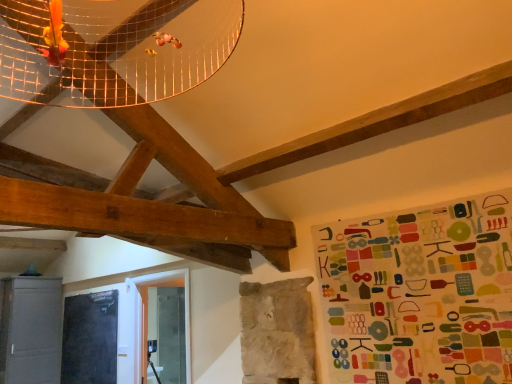
The width and height of the screenshot is (512, 384). What are the coordinates of `black matte bulletin board at lower left` in the screenshot? It's located at (90, 338).

In order to face black matte bulletin board at lower left, should I rotate leftwards or rightwards?

You should rotate left by 21.650 degrees.

What do you see at coordinates (90, 338) in the screenshot?
I see `black matte bulletin board at lower left` at bounding box center [90, 338].

Measure the distance between black matte bulletin board at lower left and camera.

A distance of 4.61 meters exists between black matte bulletin board at lower left and camera.

I want to click on matte gray cabinet at lower left, so click(x=31, y=330).

Describe the element at coordinates (31, 330) in the screenshot. This screenshot has width=512, height=384. I see `matte gray cabinet at lower left` at that location.

Identify the location of black matte bulletin board at lower left. (90, 338).

Would you say black matte bulletin board at lower left is to the left or to the right of matte gray cabinet at lower left in the picture?

Clearly, black matte bulletin board at lower left is on the right of matte gray cabinet at lower left in the image.

Which is in front, black matte bulletin board at lower left or matte gray cabinet at lower left?

black matte bulletin board at lower left is closer to the camera.

Does point (91, 329) appear closer or farther from the camera than point (21, 355)?

Point (91, 329) appears to be farther away from the viewer than point (21, 355).

From the image's perspective, would you say black matte bulletin board at lower left is positioned over matte gray cabinet at lower left?

Yes, from the image's perspective, black matte bulletin board at lower left is over matte gray cabinet at lower left.

From a real-world perspective, is black matte bulletin board at lower left on top of matte gray cabinet at lower left?

No, from a real-world perspective, black matte bulletin board at lower left is not on top of matte gray cabinet at lower left.

Between black matte bulletin board at lower left and matte gray cabinet at lower left, which one has larger width?

matte gray cabinet at lower left.

Considering the sizes of black matte bulletin board at lower left and matte gray cabinet at lower left in the image, is black matte bulletin board at lower left taller or shorter than matte gray cabinet at lower left?

Clearly, black matte bulletin board at lower left is shorter compared to matte gray cabinet at lower left.

Who is smaller, black matte bulletin board at lower left or matte gray cabinet at lower left?

black matte bulletin board at lower left.

Is matte gray cabinet at lower left a part of black matte bulletin board at lower left?

That's incorrect, matte gray cabinet at lower left is not inside black matte bulletin board at lower left.

Is the surface of black matte bulletin board at lower left in direct contact with matte gray cabinet at lower left?

No, black matte bulletin board at lower left is not touching matte gray cabinet at lower left.

Is black matte bulletin board at lower left looking in the opposite direction of matte gray cabinet at lower left?

No.

In order to click on cabinetry located on the left of black matte bulletin board at lower left in this screenshot , I will do 31,330.

Is matte gray cabinet at lower left at the right side of black matte bulletin board at lower left?

In fact, matte gray cabinet at lower left is to the left of black matte bulletin board at lower left.

Who is more distant, matte gray cabinet at lower left or black matte bulletin board at lower left?

Positioned behind is matte gray cabinet at lower left.

Is point (30, 349) farther from camera compared to point (69, 354)?

No, it is not.

From the image's perspective, which is below, matte gray cabinet at lower left or black matte bulletin board at lower left?

matte gray cabinet at lower left appears lower in the image.

From a real-world perspective, is matte gray cabinet at lower left below black matte bulletin board at lower left?

No, from a real-world perspective, matte gray cabinet at lower left is not below black matte bulletin board at lower left.

In terms of width, does matte gray cabinet at lower left look wider or thinner when compared to black matte bulletin board at lower left?

In the image, matte gray cabinet at lower left appears to be wider than black matte bulletin board at lower left.

From their relative heights in the image, would you say matte gray cabinet at lower left is taller or shorter than black matte bulletin board at lower left?

Clearly, matte gray cabinet at lower left is taller compared to black matte bulletin board at lower left.

Which of these two, matte gray cabinet at lower left or black matte bulletin board at lower left, is smaller?

black matte bulletin board at lower left is smaller.

Is black matte bulletin board at lower left inside matte gray cabinet at lower left?

That's incorrect, black matte bulletin board at lower left is not inside matte gray cabinet at lower left.

Is matte gray cabinet at lower left not close to black matte bulletin board at lower left?

No, there isn't a large distance between matte gray cabinet at lower left and black matte bulletin board at lower left.

Is matte gray cabinet at lower left turned away from black matte bulletin board at lower left?

That's not correct — matte gray cabinet at lower left is not looking away from black matte bulletin board at lower left.

How different are the orientations of matte gray cabinet at lower left and black matte bulletin board at lower left in degrees?

They differ by 89.8 degrees in their facing directions.

Measure the distance between matte gray cabinet at lower left and black matte bulletin board at lower left.

A distance of 15.88 inches exists between matte gray cabinet at lower left and black matte bulletin board at lower left.

Locate an element on the screen. This screenshot has width=512, height=384. cabinetry above the black matte bulletin board at lower left (from a real-world perspective) is located at coordinates (31, 330).

The height and width of the screenshot is (384, 512). What are the coordinates of `cabinetry that appears behind the black matte bulletin board at lower left` in the screenshot? It's located at (31, 330).

There is a black matte bulletin board at lower left. Where is `cabinetry above it (from a real-world perspective)`? The width and height of the screenshot is (512, 384). cabinetry above it (from a real-world perspective) is located at coordinates (31, 330).